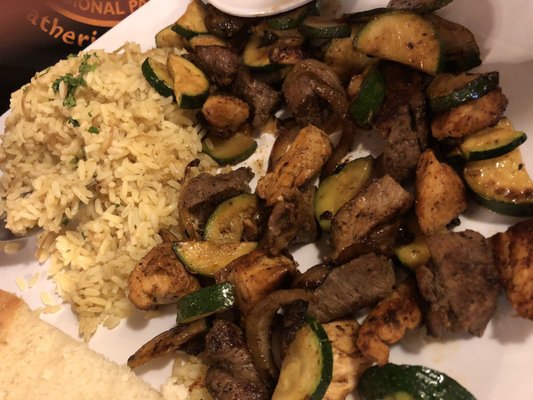
Where is `cup`? cup is located at coordinates (265, 13).